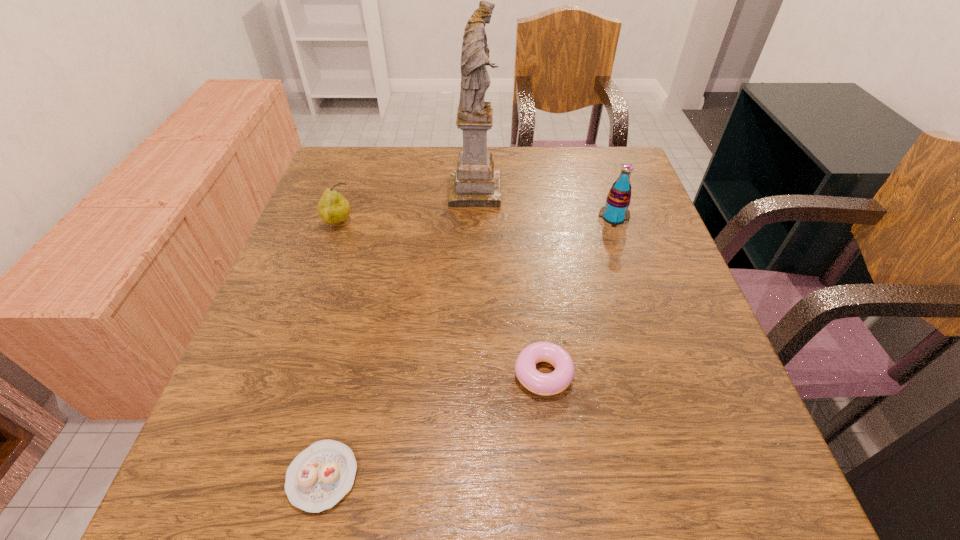
This screenshot has width=960, height=540. I want to click on the tallest object, so click(x=475, y=183).

You are a GUI agent. You are given a task and a screenshot of the screen. Output one action in this format:
    pyautogui.click(x=<x>, y=<y>)
    Task: Click on the sculpture
    This screenshot has width=960, height=540.
    Given the screenshot: What is the action you would take?
    pyautogui.click(x=475, y=183)

In order to click on the rightmost object in this screenshot , I will do `click(615, 212)`.

The width and height of the screenshot is (960, 540). Identify the location of the fourth shortest object. pyautogui.click(x=615, y=212).

Image resolution: width=960 pixels, height=540 pixels. I want to click on pear, so click(333, 208).

Locate an element on the screen. This screenshot has width=960, height=540. the leftmost object is located at coordinates coord(333,208).

Identify the location of doughnut. (557, 381).

Locate an element on the screen. the fourth farthest object is located at coordinates (557, 381).

You are a GUI agent. You are given a task and a screenshot of the screen. Output one action in this format:
    pyautogui.click(x=<x>, y=<y>)
    Task: Click on the nearest object
    The width and height of the screenshot is (960, 540).
    Given the screenshot: What is the action you would take?
    pyautogui.click(x=320, y=476)

At what (x,y) coordinates should I click in order to perform the action: click on the second object from left to right. Please return your answer as a coordinate pair (x, y). Looking at the image, I should click on (320, 476).